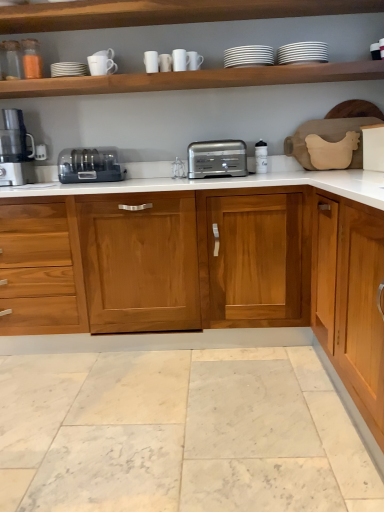
Identify the location of white matte cup at upper center, positioned as the 5th tableware in right-to-left order. (151, 61).

Describe the element at coordinates (89, 165) in the screenshot. I see `satin silver toaster at center, the first toaster in the left-to-right sequence` at that location.

Describe the element at coordinates (15, 150) in the screenshot. I see `matte black coffee machine at left` at that location.

Where is `matte black coffee machine at left`? The width and height of the screenshot is (384, 512). matte black coffee machine at left is located at coordinates (15, 150).

What do you see at coordinates (248, 56) in the screenshot? I see `white glossy plates at upper center, which ranks as the 2th tableware in right-to-left order` at bounding box center [248, 56].

In order to face white marble floor at lower center, should I rotate leftwards or rightwards?

Rotate your view left by about 7.027°.

Image resolution: width=384 pixels, height=512 pixels. What do you see at coordinates (179, 433) in the screenshot?
I see `white marble floor at lower center` at bounding box center [179, 433].

Describe the element at coordinates (303, 53) in the screenshot. This screenshot has height=512, width=384. I see `white glossy plates at upper center, marked as the first tableware in a right-to-left arrangement` at that location.

I want to click on white ceramic mug at upper center, the sixth tableware from the right, so click(x=101, y=65).

In terms of height, does white ceramic mug at upper center, placed as the 1th tableware when sorted from left to right, look taller or shorter compared to white glossy mug at upper center, the 3th tableware viewed from the right?

In the image, white ceramic mug at upper center, placed as the 1th tableware when sorted from left to right, appears to be shorter than white glossy mug at upper center, the 3th tableware viewed from the right.

From the picture: Is white glossy mug at upper center, positioned as the fourth tableware in left-to-right order, located within white ceramic mug at upper center, placed as the 1th tableware when sorted from left to right?

No, white ceramic mug at upper center, placed as the 1th tableware when sorted from left to right, does not contain white glossy mug at upper center, positioned as the fourth tableware in left-to-right order.

Starting from the white glossy mug at upper center, the 3th tableware viewed from the right, which tableware is the 3rd one to the left? Please provide its 2D coordinates.

[(101, 65)]

Would you say matte black coffee machine at left is a long distance from wooden cabinet at center?

matte black coffee machine at left is actually quite close to wooden cabinet at center.

Does point (25, 167) appear closer or farther from the camera than point (273, 321)?

Point (25, 167) appears to be farther away from the viewer than point (273, 321).

Considering the positions of objects matte black coffee machine at left and wooden cabinet at center in the image provided, who is in front, matte black coffee machine at left or wooden cabinet at center?

wooden cabinet at center is in front.

From a real-world perspective, between matte black coffee machine at left and wooden cabinet at center, who is vertically higher?

From a 3D spatial view, matte black coffee machine at left is above.

Is satin silver toaster at center, the first toaster in the left-to-right sequence, completely or partially inside white glossy plates at upper center, acting as the 6th tableware starting from the left?

Definitely not — satin silver toaster at center, the first toaster in the left-to-right sequence, is not inside white glossy plates at upper center, acting as the 6th tableware starting from the left.

From a real-world perspective, relative to satin silver toaster at center, arranged as the second toaster when viewed from the right, is white glossy plates at upper center, marked as the first tableware in a right-to-left arrangement, vertically above or below?

Clearly, from a real-world perspective, white glossy plates at upper center, marked as the first tableware in a right-to-left arrangement, is above satin silver toaster at center, arranged as the second toaster when viewed from the right.

Does white glossy plates at upper center, acting as the 6th tableware starting from the left, lie behind satin silver toaster at center, arranged as the second toaster when viewed from the right?

No, it is in front of satin silver toaster at center, arranged as the second toaster when viewed from the right.

Which point is more forward, (307, 54) or (102, 148)?

The point (307, 54) is closer.

Visually, is white glossy plates at upper center, which ranks as the 2th tableware in right-to-left order, positioned to the left or to the right of white glossy mug at upper center, positioned as the fourth tableware in left-to-right order?

white glossy plates at upper center, which ranks as the 2th tableware in right-to-left order, is to the right of white glossy mug at upper center, positioned as the fourth tableware in left-to-right order.

Is white glossy plates at upper center, which ranks as the 2th tableware in right-to-left order, facing towards white glossy mug at upper center, the 3th tableware viewed from the right?

No, white glossy plates at upper center, which ranks as the 2th tableware in right-to-left order, is not oriented towards white glossy mug at upper center, the 3th tableware viewed from the right.

From a real-world perspective, is white glossy plates at upper center, which ranks as the 2th tableware in right-to-left order, over white glossy mug at upper center, the 3th tableware viewed from the right?

Yes, from a real-world perspective, white glossy plates at upper center, which ranks as the 2th tableware in right-to-left order, is over white glossy mug at upper center, the 3th tableware viewed from the right

Can we say wooden shelf at upper center, which is the first shelf from top to bottom, lies outside white matte wood shelf at upper center, the first shelf from the bottom?

Yes, wooden shelf at upper center, which is the first shelf from top to bottom, is not within white matte wood shelf at upper center, the first shelf from the bottom.

Can you confirm if wooden shelf at upper center, which is the first shelf from top to bottom, is taller than white matte wood shelf at upper center, the first shelf from the bottom?

In fact, wooden shelf at upper center, which is the first shelf from top to bottom, may be shorter than white matte wood shelf at upper center, the first shelf from the bottom.

Are wooden shelf at upper center, which is the first shelf from top to bottom, and white matte wood shelf at upper center, the 2th shelf from the top, beside each other?

wooden shelf at upper center, which is the first shelf from top to bottom, is not next to white matte wood shelf at upper center, the 2th shelf from the top, and they're not touching.

In terms of width, does wooden cabinet at center look wider or thinner when compared to satin silver toaster at center, the first toaster from the right?

Considering their sizes, wooden cabinet at center looks broader than satin silver toaster at center, the first toaster from the right.

From a real-world perspective, who is located lower, wooden cabinet at center or satin silver toaster at center, the first toaster from the right?

wooden cabinet at center, from a real-world perspective.

Does wooden cabinet at center turn towards satin silver toaster at center, the 2th toaster positioned from the left?

No, wooden cabinet at center is not aimed at satin silver toaster at center, the 2th toaster positioned from the left.

Image resolution: width=384 pixels, height=512 pixels. Find the location of `cabinetry on the left of the satin silver toaster at center, the 2th toaster positioned from the left`. cabinetry on the left of the satin silver toaster at center, the 2th toaster positioned from the left is located at coordinates (145, 263).

Is white marble floor at lower center thinner than white glossy plates at upper center, which ranks as the 2th tableware in right-to-left order?

No, white marble floor at lower center is not thinner than white glossy plates at upper center, which ranks as the 2th tableware in right-to-left order.

Consider the image. Does white marble floor at lower center come behind white glossy plates at upper center, positioned as the 5th tableware in left-to-right order?

That is False.

How distant is white marble floor at lower center from white glossy plates at upper center, which ranks as the 2th tableware in right-to-left order?

The distance of white marble floor at lower center from white glossy plates at upper center, which ranks as the 2th tableware in right-to-left order, is 1.83 meters.

Which object is positioned more to the left, white marble floor at lower center or white glossy plates at upper center, which ranks as the 2th tableware in right-to-left order?

Positioned to the left is white marble floor at lower center.

Locate an element on the screen. the 2nd tableware positioned below the white glossy mug at upper center, the 3th tableware viewed from the right (from a real-world perspective) is located at coordinates (101, 65).

Locate an element on the screen. The width and height of the screenshot is (384, 512). coffee machine on the left of wooden cabinet at center is located at coordinates (15, 150).

Based on their spatial positions, is white glossy plates at upper center, acting as the 6th tableware starting from the left, or wooden shelf at upper center, which is the first shelf from top to bottom, closer to white glossy plates at upper center, which ranks as the 2th tableware in right-to-left order?

white glossy plates at upper center, acting as the 6th tableware starting from the left.

From the image, which object appears to be nearer to white glossy plates at upper center, marked as the first tableware in a right-to-left arrangement, wooden shelf at upper center, which is the first shelf from top to bottom, or white glossy mug at upper center, the 3th tableware viewed from the right?

white glossy mug at upper center, the 3th tableware viewed from the right, lies closer to white glossy plates at upper center, marked as the first tableware in a right-to-left arrangement, than the other object.

Based on their spatial positions, is white glossy plates at upper center, marked as the first tableware in a right-to-left arrangement, or white ceramic mug at upper center, the sixth tableware from the right, closer to satin silver toaster at center, the 2th toaster positioned from the left?

white glossy plates at upper center, marked as the first tableware in a right-to-left arrangement, lies closer to satin silver toaster at center, the 2th toaster positioned from the left, than the other object.

In the scene shown: Considering their positions, is white glossy plates at upper center, positioned as the 5th tableware in left-to-right order, positioned closer to white marble floor at lower center than white glossy mug at upper center, positioned as the fourth tableware in left-to-right order?

Among the two, white glossy plates at upper center, positioned as the 5th tableware in left-to-right order, is located nearer to white marble floor at lower center.

Based on the photo, estimate the real-world distances between objects in this image. Which object is further from satin silver toaster at center, the first toaster from the right, wooden cabinet at center or white glossy mug at upper center, positioned as the fourth tableware in left-to-right order?

wooden cabinet at center is positioned further to the anchor satin silver toaster at center, the first toaster from the right.

Which object lies nearer to the anchor point matte black coffee machine at left, white ceramic mug at upper center, the sixth tableware from the right, or white glossy plates at upper center, marked as the first tableware in a right-to-left arrangement?

white ceramic mug at upper center, the sixth tableware from the right, is positioned closer to the anchor matte black coffee machine at left.

Considering their positions, is white glossy mug at upper center, the fourth tableware positioned from the right, positioned closer to satin silver toaster at center, the first toaster in the left-to-right sequence, than white ceramic mug at upper center, placed as the 1th tableware when sorted from left to right?

white ceramic mug at upper center, placed as the 1th tableware when sorted from left to right.

Looking at the image, which one is located closer to satin silver toaster at center, the first toaster in the left-to-right sequence, wooden shelf at upper center, which is the first shelf from top to bottom, or white matte wood shelf at upper center, the first shelf from the bottom?

Among the two, white matte wood shelf at upper center, the first shelf from the bottom, is located nearer to satin silver toaster at center, the first toaster in the left-to-right sequence.

Where is `cabinetry between white glossy mug at upper center, positioned as the fourth tableware in left-to-right order, and white marble floor at lower center in the up-down direction`? cabinetry between white glossy mug at upper center, positioned as the fourth tableware in left-to-right order, and white marble floor at lower center in the up-down direction is located at coordinates (145, 263).

Identify the location of toaster between matte black coffee machine at left and white glossy mug at upper center, the 3th tableware viewed from the right, from left to right. (89, 165).

Locate an element on the screen. The image size is (384, 512). shelf between wooden shelf at upper center, which is the first shelf from top to bottom, and wooden cabinet at center in the up-down direction is located at coordinates (193, 79).

Identify the location of toaster between matte black coffee machine at left and wooden shelf at upper center, which appears as the 2th shelf when ordered from the bottom. (89, 165).